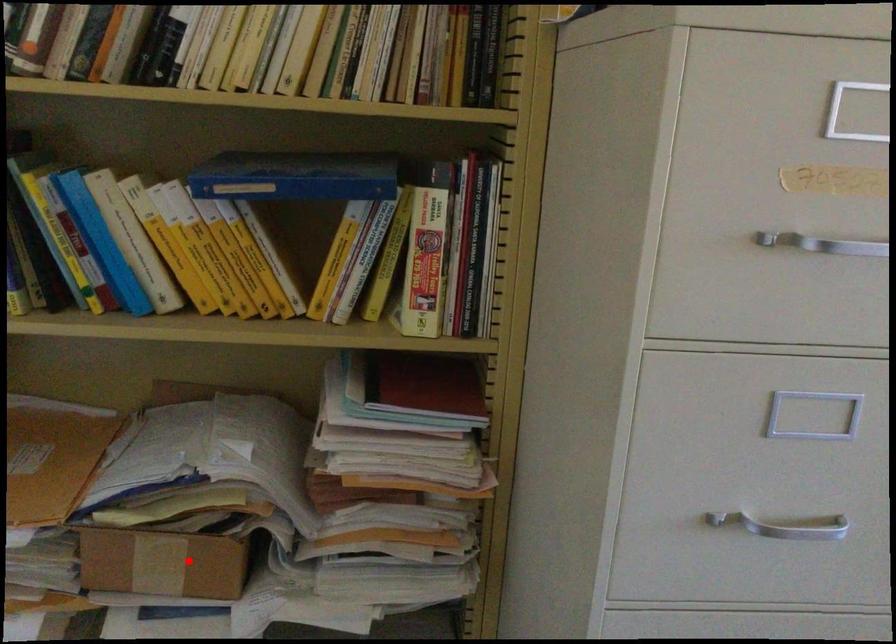
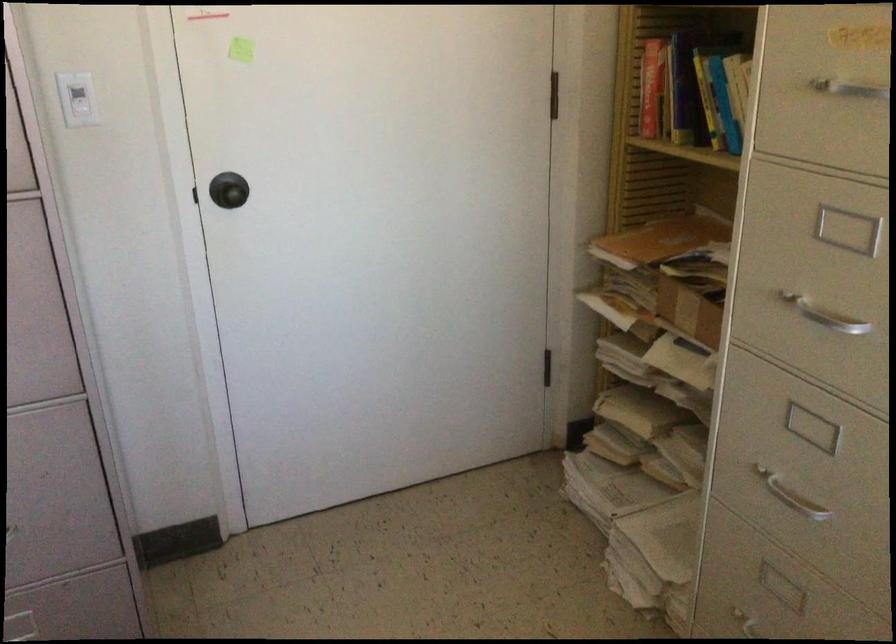
Locate, in the second image, the point that corresponds to the highlighted location in the first image.

(688, 310)